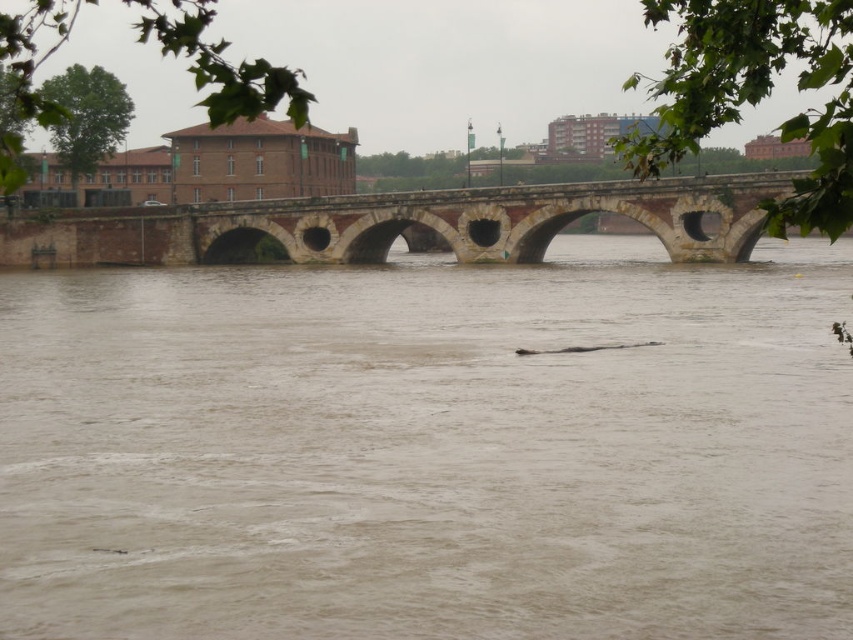
Question: Does brown muddy water at center appear over brown stone bridge at center?

Choices:
 (A) no
 (B) yes

Answer: (A)

Question: Can you confirm if brown muddy water at center is positioned to the right of brown stone bridge at center?

Choices:
 (A) yes
 (B) no

Answer: (B)

Question: Which point appears farthest from the camera in this image?

Choices:
 (A) (676, 230)
 (B) (784, 320)

Answer: (A)

Question: Which point is closer to the camera?

Choices:
 (A) brown muddy water at center
 (B) brown stone bridge at center

Answer: (A)

Question: Can you confirm if brown muddy water at center is smaller than brown stone bridge at center?

Choices:
 (A) no
 (B) yes

Answer: (A)

Question: Among these objects, which one is farthest from the camera?

Choices:
 (A) brown muddy water at center
 (B) brown stone bridge at center

Answer: (B)